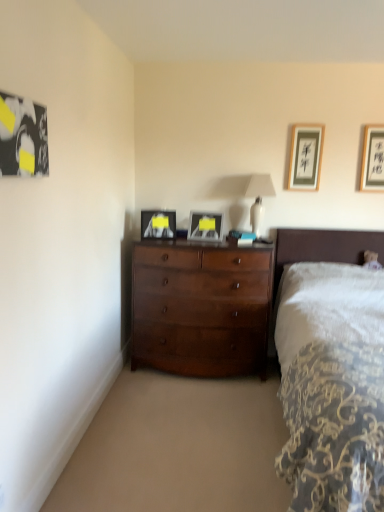
Question: Is white glossy table lamp at upper center positioned far away from dark wood bed at right?

Choices:
 (A) yes
 (B) no

Answer: (B)

Question: Can you confirm if white glossy table lamp at upper center is shorter than dark wood bed at right?

Choices:
 (A) yes
 (B) no

Answer: (A)

Question: Is the position of white glossy table lamp at upper center less distant than that of dark wood bed at right?

Choices:
 (A) no
 (B) yes

Answer: (A)

Question: Is dark wood bed at right a part of white glossy table lamp at upper center?

Choices:
 (A) no
 (B) yes

Answer: (A)

Question: Can you confirm if white glossy table lamp at upper center is smaller than dark wood bed at right?

Choices:
 (A) yes
 (B) no

Answer: (A)

Question: Could you tell me if white glossy table lamp at upper center is facing dark wood bed at right?

Choices:
 (A) yes
 (B) no

Answer: (B)

Question: From a real-world perspective, does matte black picture frame at center, marked as the 3th picture frame in a back-to-front arrangement, stand above metallic silver picture frame at center, the fourth picture frame from the back?

Choices:
 (A) yes
 (B) no

Answer: (B)

Question: Is matte black picture frame at center, which ranks as the third picture frame in front-to-back order, aimed at metallic silver picture frame at center, which is counted as the second picture frame, starting from the front?

Choices:
 (A) yes
 (B) no

Answer: (B)

Question: From a real-world perspective, is matte black picture frame at center, which ranks as the third picture frame in front-to-back order, located beneath metallic silver picture frame at center, which is counted as the second picture frame, starting from the front?

Choices:
 (A) yes
 (B) no

Answer: (A)

Question: Can you confirm if matte black picture frame at center, which is counted as the second picture frame, starting from the left, is shorter than metallic silver picture frame at center, the third picture frame in the left-to-right sequence?

Choices:
 (A) yes
 (B) no

Answer: (A)

Question: Considering the relative sizes of matte black picture frame at center, which ranks as the third picture frame in front-to-back order, and metallic silver picture frame at center, which is counted as the second picture frame, starting from the front, in the image provided, is matte black picture frame at center, which ranks as the third picture frame in front-to-back order, bigger than metallic silver picture frame at center, which is counted as the second picture frame, starting from the front,?

Choices:
 (A) no
 (B) yes

Answer: (B)

Question: Can you confirm if matte black picture frame at center, which ranks as the third picture frame in front-to-back order, is taller than metallic silver picture frame at center, the fourth picture frame from the back?

Choices:
 (A) yes
 (B) no

Answer: (B)

Question: From a real-world perspective, is shiny brown dresser at center below matte black picture frame at center, marked as the 3th picture frame in a back-to-front arrangement?

Choices:
 (A) no
 (B) yes

Answer: (B)